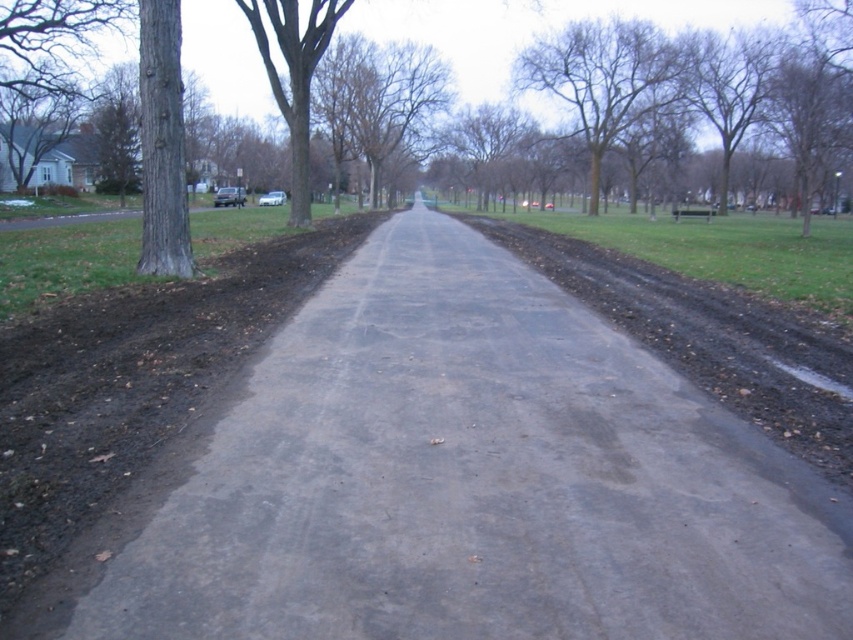
Question: Considering the relative positions of gray asphalt path at center and brown rough tree at left in the image provided, where is gray asphalt path at center located with respect to brown rough tree at left?

Choices:
 (A) left
 (B) right

Answer: (B)

Question: Considering the real-world distances, which object is farthest from the gray asphalt path at center?

Choices:
 (A) bare branches at upper center
 (B) brown rough tree at left

Answer: (A)

Question: Among these points, which one is nearest to the camera?

Choices:
 (A) (576, 433)
 (B) (635, 106)
 (C) (314, 1)

Answer: (A)

Question: Estimate the real-world distances between objects in this image. Which object is closer to the gray asphalt path at center?

Choices:
 (A) brown rough tree at left
 (B) bare branches at upper center

Answer: (A)

Question: Can you confirm if bare branches at upper center is thinner than brown rough tree at left?

Choices:
 (A) no
 (B) yes

Answer: (B)

Question: Is gray asphalt path at center above brown rough tree at left?

Choices:
 (A) yes
 (B) no

Answer: (B)